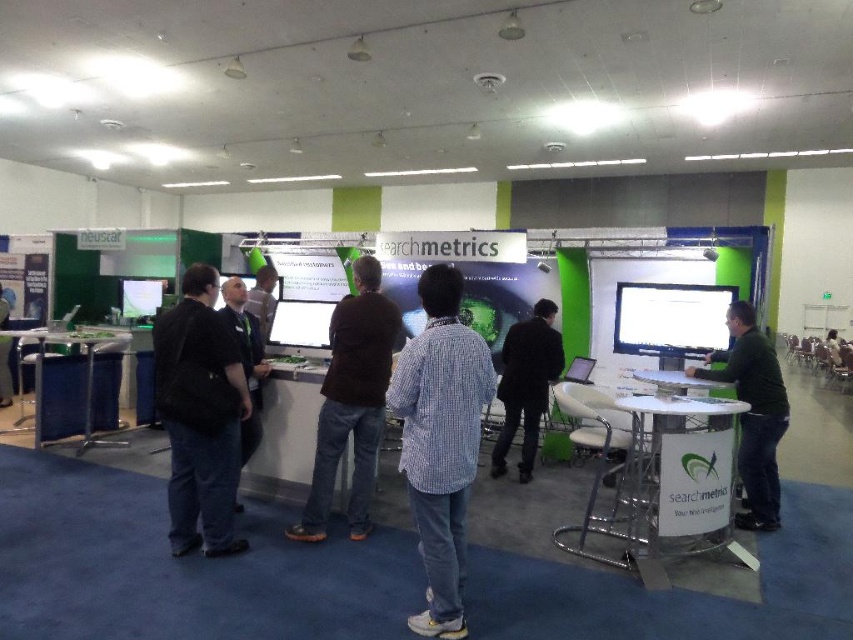
Which is more to the left, black fabric shirt at center or black glossy tablet at center?

black fabric shirt at center is more to the left.

Is black fabric shirt at center further to camera compared to black glossy tablet at center?

That is False.

Between point (254, 436) and point (573, 371), which one is positioned in front?

Positioned in front is point (254, 436).

The image size is (853, 640). In order to click on black fabric shirt at center in this screenshot , I will do `click(247, 358)`.

Does checkered shirt at center appear over dark brown leather jacket at center?

No.

Does point (422, 624) come closer to viewer compared to point (546, 353)?

Yes, point (422, 624) is closer to viewer.

Locate an element on the screen. The image size is (853, 640). checkered shirt at center is located at coordinates (440, 440).

Can you confirm if black fabric shirt at center is positioned to the left of matte black jacket at center?

No, black fabric shirt at center is not to the left of matte black jacket at center.

Does point (242, 307) come behind point (1, 364)?

No, it is not.

Is point (250, 346) positioned before point (4, 387)?

That is True.

The image size is (853, 640). In order to click on black fabric shirt at center in this screenshot , I will do `click(247, 358)`.